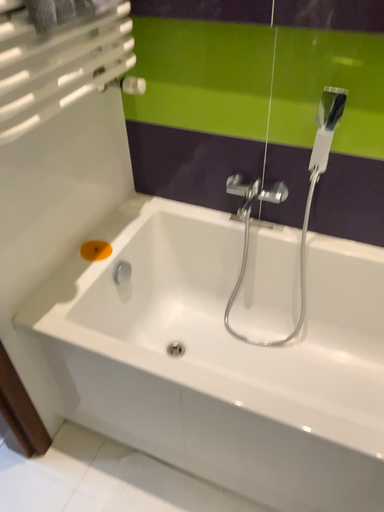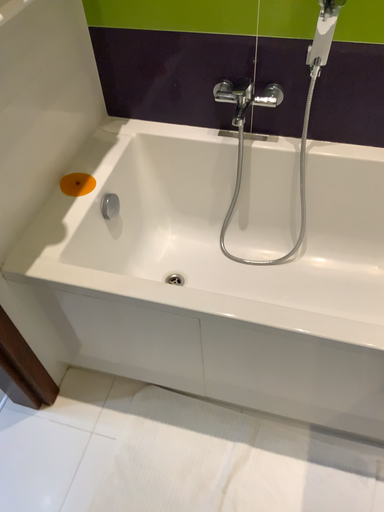
Question: How did the camera likely rotate when shooting the video?

Choices:
 (A) rotated upward
 (B) rotated downward

Answer: (B)